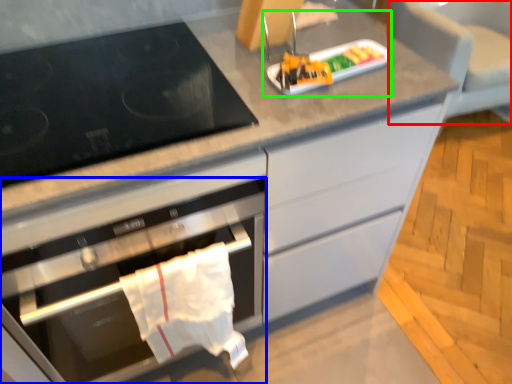
Question: Based on their relative distances, which object is nearer to armchair (highlighted by a red box)? Choose from oven (highlighted by a blue box) and appliance (highlighted by a green box).

Choices:
 (A) oven
 (B) appliance

Answer: (B)